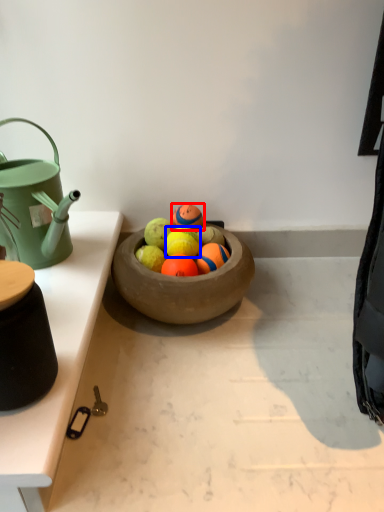
Question: Which object is closer to the camera taking this photo, tennis ball (highlighted by a red box) or fruit (highlighted by a blue box)?

Choices:
 (A) tennis ball
 (B) fruit

Answer: (B)